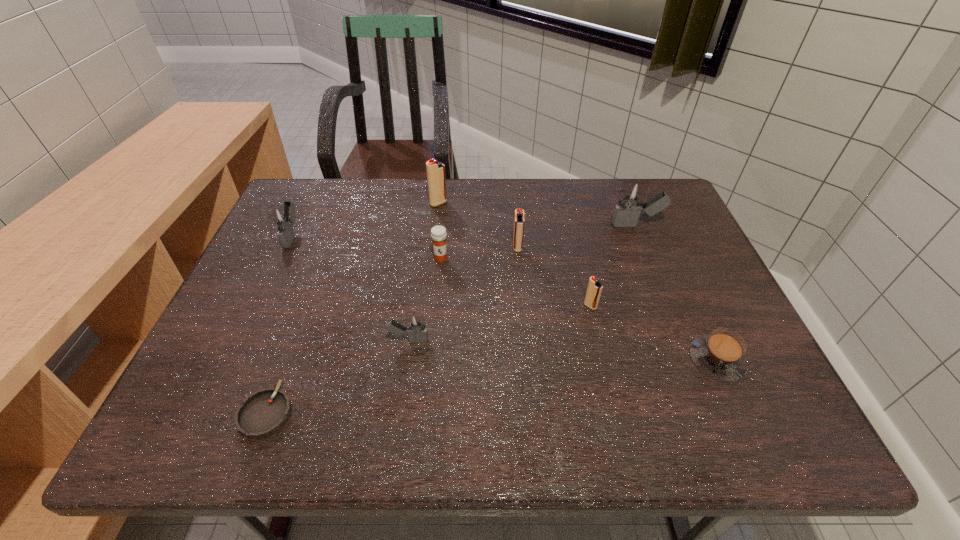
At what (x,y) coordinates should I click in order to perform the action: click on vacant region located on the back of the second biggest red igniter. Please return your answer as a coordinate pair (x, y). Looking at the image, I should click on (512, 191).

I want to click on vacant region located on the label side of the fifth farthest object, so click(431, 364).

Where is `free region located on the back of the third object from right to left`? This screenshot has width=960, height=540. free region located on the back of the third object from right to left is located at coordinates pyautogui.click(x=576, y=244).

Identify the location of vacant space located 0.330m on the back of the smallest gray igniter. click(x=423, y=238).

The height and width of the screenshot is (540, 960). Identify the location of free space located 0.270m on the left of the brown cappuccino. (563, 360).

At what (x,y) coordinates should I click in order to perform the action: click on free space located 0.210m on the back of the shortest object. Please return your answer as a coordinate pair (x, y). This screenshot has width=960, height=540. Looking at the image, I should click on 305,308.

Find the location of a particular element. The width and height of the screenshot is (960, 540). object positioned at the near edge is located at coordinates (263, 413).

The height and width of the screenshot is (540, 960). I want to click on igniter at the left edge, so click(282, 217).

Identify the location of ashtray that is at the left edge. This screenshot has width=960, height=540. (263, 413).

Locate an element on the screen. igniter positioned at the right edge is located at coordinates (631, 198).